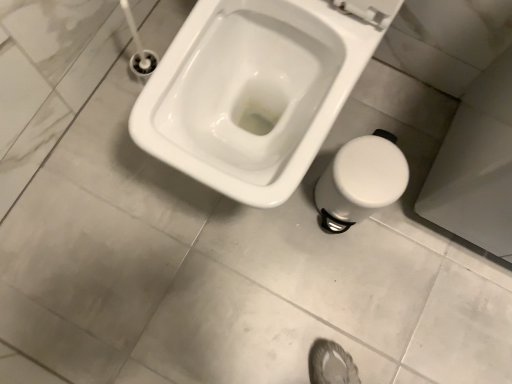
This screenshot has height=384, width=512. What are the coordinates of `vacant space positioned to the left of white glossy toilet at center` in the screenshot? It's located at (92, 148).